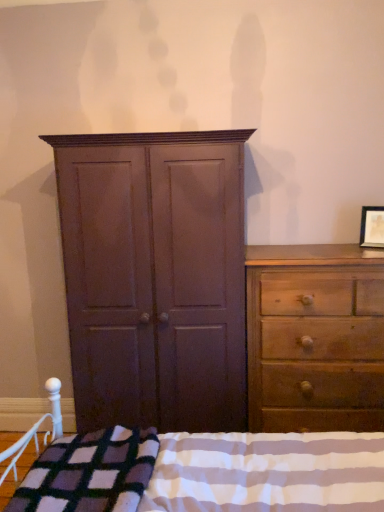
At what (x,y) coordinates should I click in order to perform the action: click on empty space that is ontop of plush purple blanket at lower left (from a real-world perspective). Please return your answer as a coordinate pair (x, y). Looking at the image, I should click on (109, 459).